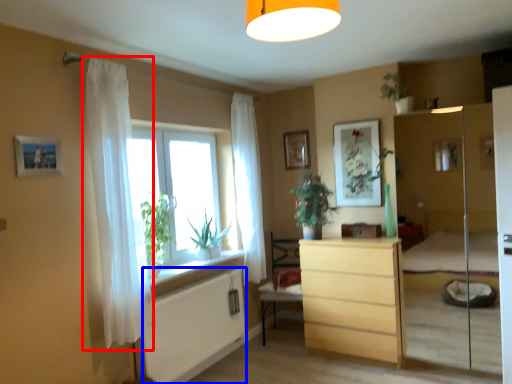
Question: Which of the following is the farthest to the observer, curtain (highlighted by a red box) or radiator (highlighted by a blue box)?

Choices:
 (A) curtain
 (B) radiator

Answer: (B)